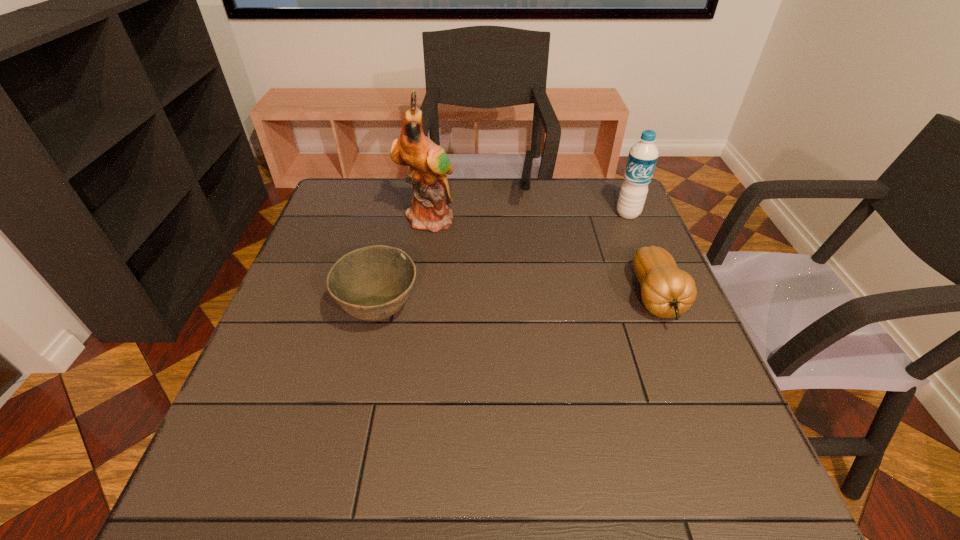
You are a GUI agent. You are given a task and a screenshot of the screen. Output one action in this format:
    pyautogui.click(x=<x>, y=<y>)
    Task: Click on the free region located on the front-facing side of the parrot
    This screenshot has width=960, height=540.
    Given the screenshot: What is the action you would take?
    pyautogui.click(x=448, y=244)

Where is `vacant area situated 0.100m on the front-facing side of the parrot`? This screenshot has width=960, height=540. vacant area situated 0.100m on the front-facing side of the parrot is located at coordinates (457, 254).

The width and height of the screenshot is (960, 540). I want to click on vacant space located 0.290m on the front-facing side of the parrot, so click(x=495, y=298).

The width and height of the screenshot is (960, 540). What are the coordinates of `blank space located on the label of the water bottle` in the screenshot? It's located at (593, 259).

The height and width of the screenshot is (540, 960). Identify the location of vacant space located on the label of the water bottle. tap(595, 257).

I want to click on vacant position located 0.320m on the label of the water bottle, so click(575, 284).

At what (x,y) coordinates should I click in order to perform the action: click on pistol positioned at the far edge. Please return your answer as a coordinate pair (x, y). The image size is (960, 540). Looking at the image, I should click on (525, 182).

This screenshot has width=960, height=540. I want to click on parrot present at the far edge, so click(429, 164).

Where is `water bottle positioned at the far edge`? water bottle positioned at the far edge is located at coordinates (643, 156).

I want to click on object present at the left edge, so click(372, 283).